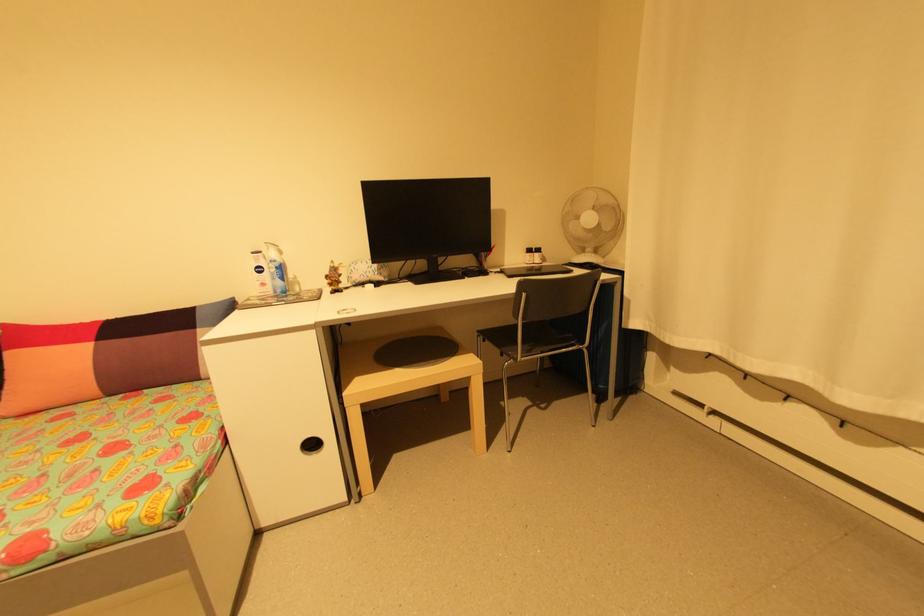
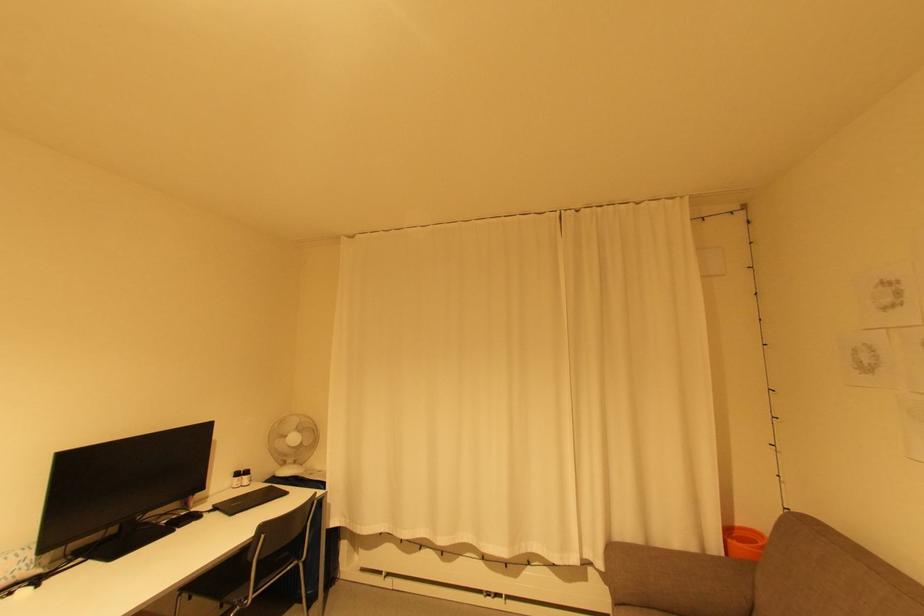
Find the pixel in the second image that matches [541,254] in the first image.

(250, 477)